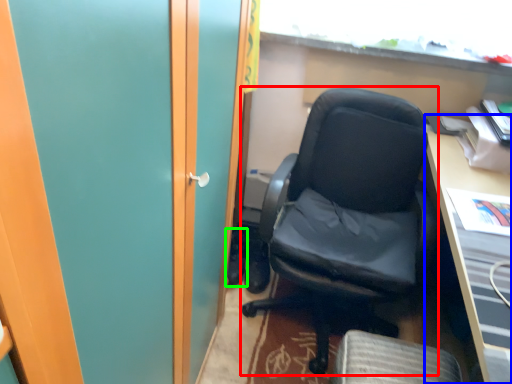
Question: Estimate the real-world distances between objects in this image. Which object is closer to chair (highlighted by a red box), desk (highlighted by a blue box) or footwear (highlighted by a green box)?

Choices:
 (A) desk
 (B) footwear

Answer: (A)